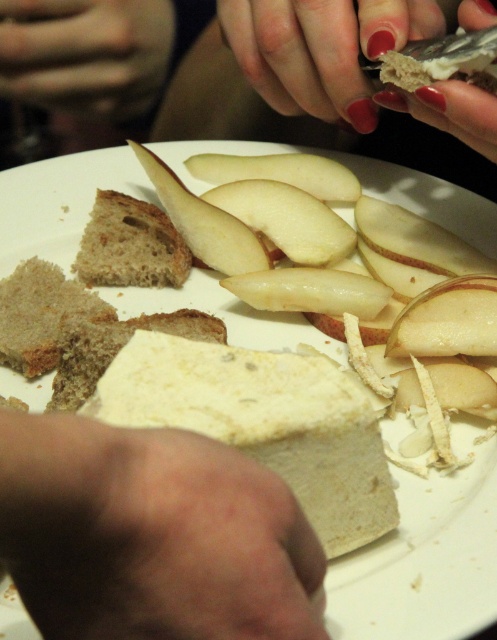
Looking at this image, you are a chef preparing a dish that requires layering ingredients. You have the brown crusty bread at left and the white smooth apple at center. Which ingredient should you choose if you need a thicker slice for the base of the dish?

The white smooth apple at center is thicker than the brown crusty bread at left, so you should choose the white smooth apple at center for the base of the dish.

Looking at the plate with both the smooth beige bread at center and the white smooth apple at center, which one is positioned to the left?

The smooth beige bread at center is positioned to the left of the white smooth apple at center.